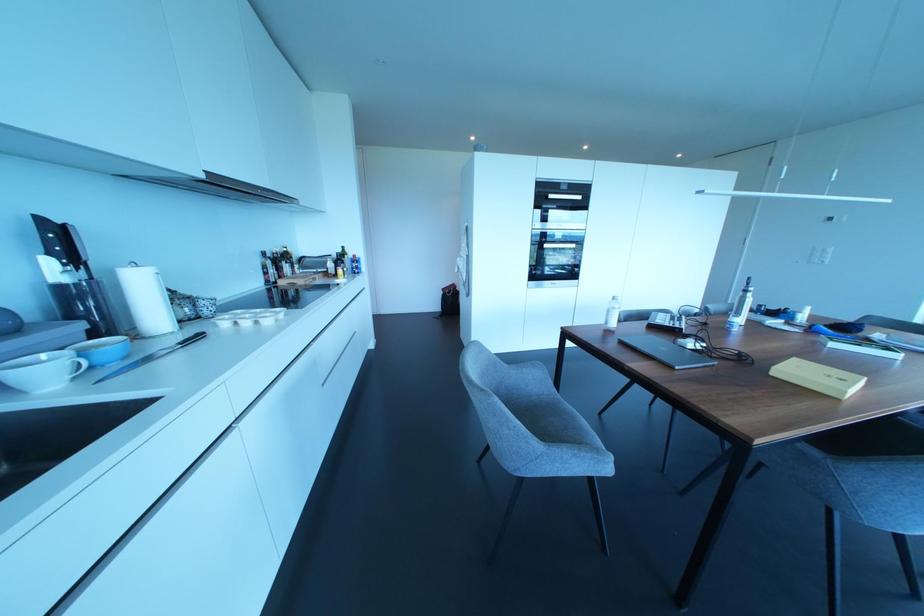
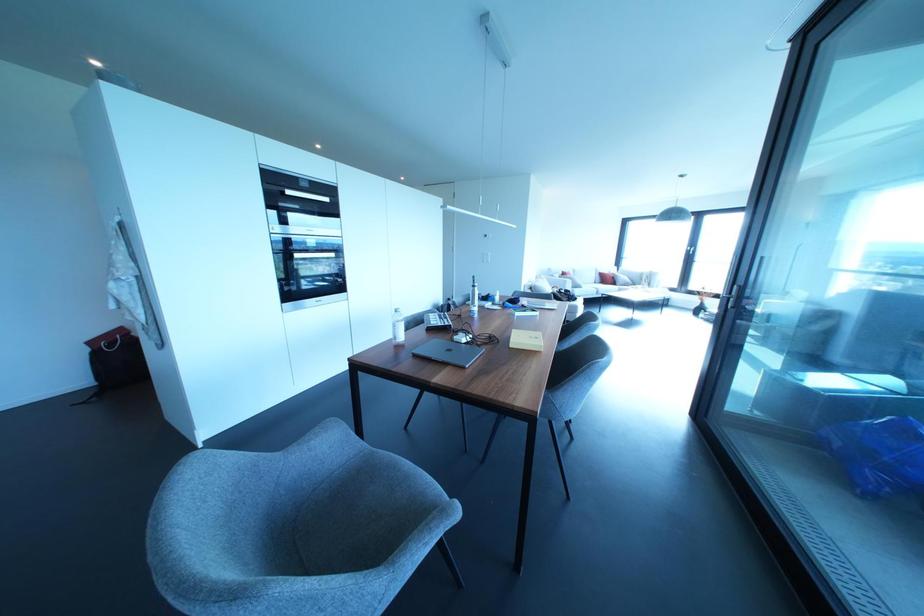
Question: How did the camera likely rotate?

Choices:
 (A) Left
 (B) Right
 (C) Up
 (D) Down

Answer: (B)